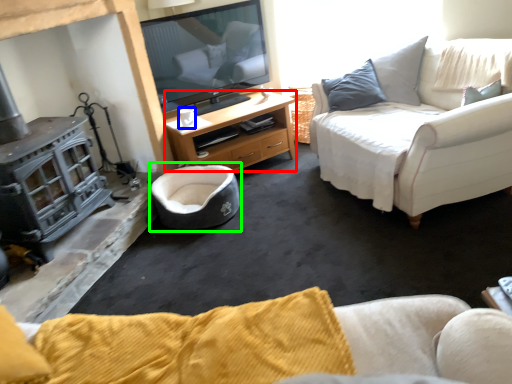
Question: Based on their relative distances, which object is farther from desk (highlighted by a red box)? Choose from coffee cup (highlighted by a blue box) and bean bag chair (highlighted by a green box).

Choices:
 (A) coffee cup
 (B) bean bag chair

Answer: (A)